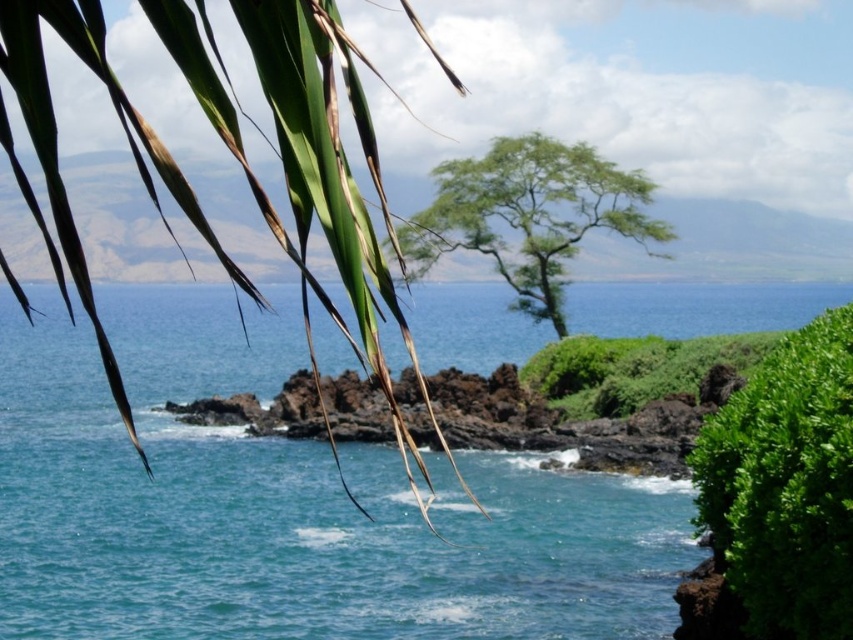
You are standing at the edge of a coastal path and see the clear blue water at center and the green leafy bush at lower right. Which object is closer to your left side?

The clear blue water at center is to the left of the green leafy bush at lower right, so it is closer to your left side.

You are standing at the point with coordinates point (x=311, y=173) in the coastal landscape. What object is located exactly at that point?

The green leafy palm tree at upper left is located exactly at point (x=311, y=173).

Consider the image. You are standing at the center of the image and want to locate the green leafy palm tree at upper left. Based on the coordinates provided, in which direction should you look to find it?

The green leafy palm tree at upper left is located at coordinates point (311, 173), so you should look to the upper left direction to find it.